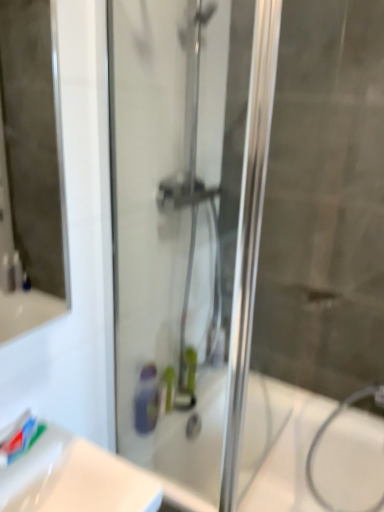
Identify the location of white matte toothpaste at lower left. (20, 437).

What do you see at coordinates (75, 479) in the screenshot?
I see `white glossy sink at lower left` at bounding box center [75, 479].

Find the location of a particular element. The image size is (384, 512). transparent glass shower door at center is located at coordinates point(183,232).

How many degrees apart are the facing directions of white glossy sink at lower left and white glossy bath at center?

89.2 degrees.

Between point (87, 462) and point (306, 451), which one is positioned in front?

Positioned in front is point (87, 462).

From the image's perspective, who appears lower, white glossy sink at lower left or white glossy bath at center?

white glossy bath at center is shown below in the image.

Does white glossy sink at lower left lie behind white glossy bath at center?

That is False.

From the image's perspective, between white glossy bath at center and white glossy sink at lower left, who is located below?

white glossy bath at center is shown below in the image.

Is white glossy bath at center situated inside white glossy sink at lower left or outside?

white glossy bath at center is spatially situated outside white glossy sink at lower left.

From a real-world perspective, which object stands above the other?

white glossy sink at lower left.

Is white glossy sink at lower left not within transparent glass shower door at center?

Yes.

Is white glossy sink at lower left shorter than transparent glass shower door at center?

Yes.

In the scene shown: Is white glossy sink at lower left smaller than transparent glass shower door at center?

Yes.

Is point (60, 495) in front of point (222, 409)?

Yes, it is in front of point (222, 409).

Based on the photo, which is less distant, (77, 509) or (17, 433)?

Clearly, point (77, 509) is closer to the camera than point (17, 433).

Considering the positions of objects white glossy sink at lower left and white matte toothpaste at lower left in the image provided, who is more to the right, white glossy sink at lower left or white matte toothpaste at lower left?

white glossy sink at lower left.

From the image's perspective, is white glossy sink at lower left on top of white matte toothpaste at lower left?

Incorrect, from the image's perspective, white glossy sink at lower left is lower than white matte toothpaste at lower left.

Considering the sizes of objects white glossy sink at lower left and white matte toothpaste at lower left in the image provided, who is shorter, white glossy sink at lower left or white matte toothpaste at lower left?

white matte toothpaste at lower left.

In terms of width, does transparent glass shower door at center look wider or thinner when compared to white matte toothpaste at lower left?

In the image, transparent glass shower door at center appears to be more narrow than white matte toothpaste at lower left.

Is transparent glass shower door at center facing towards white matte toothpaste at lower left?

Yes, transparent glass shower door at center is turned towards white matte toothpaste at lower left.

From the picture: From a real-world perspective, is transparent glass shower door at center on white matte toothpaste at lower left?

Yes.

Looking at this image, considering the sizes of transparent glass shower door at center and white matte toothpaste at lower left in the image, is transparent glass shower door at center bigger or smaller than white matte toothpaste at lower left?

transparent glass shower door at center is bigger than white matte toothpaste at lower left.

How many degrees apart are the facing directions of white matte toothpaste at lower left and white glossy bath at center?

white matte toothpaste at lower left and white glossy bath at center are facing 98 degrees away from each other.

Which is in front, point (11, 448) or point (248, 430)?

The point (11, 448) is closer to the camera.

Can you confirm if white matte toothpaste at lower left is smaller than white glossy bath at center?

Yes.

Is white matte toothpaste at lower left far away from white glossy bath at center?

Actually, white matte toothpaste at lower left and white glossy bath at center are a little close together.

Is white glossy bath at center not close to transparent glass shower door at center?

Actually, white glossy bath at center and transparent glass shower door at center are a little close together.

Is white glossy bath at center positioned in front of transparent glass shower door at center?

No, white glossy bath at center is behind transparent glass shower door at center.

From the image's perspective, does white glossy bath at center appear higher than transparent glass shower door at center?

Result: No, from the image's perspective, white glossy bath at center is not above transparent glass shower door at center.

Locate an element on the screen. bath on the right side of white glossy sink at lower left is located at coordinates (278, 445).

Find the location of a particular element. This screenshot has width=384, height=512. bath lying below the white glossy sink at lower left (from the image's perspective) is located at coordinates (278, 445).

From the image, which object appears to be nearer to white glossy sink at lower left, white glossy bath at center or white matte toothpaste at lower left?

Based on the image, white matte toothpaste at lower left appears to be nearer to white glossy sink at lower left.

From the picture: From the image, which object appears to be nearer to white glossy sink at lower left, transparent glass shower door at center or white glossy bath at center?

transparent glass shower door at center is closer to white glossy sink at lower left.

Considering their positions, is transparent glass shower door at center positioned further to white glossy sink at lower left than white matte toothpaste at lower left?

transparent glass shower door at center is positioned further to the anchor white glossy sink at lower left.

Estimate the real-world distances between objects in this image. Which object is further from transparent glass shower door at center, white glossy sink at lower left or white matte toothpaste at lower left?

Among the two, white matte toothpaste at lower left is located further to transparent glass shower door at center.

Looking at this image, when comparing their distances from transparent glass shower door at center, does white glossy bath at center or white glossy sink at lower left seem closer?

Based on the image, white glossy bath at center appears to be nearer to transparent glass shower door at center.

Estimate the real-world distances between objects in this image. Which object is further from transparent glass shower door at center, white glossy sink at lower left or white glossy bath at center?

white glossy sink at lower left is positioned further to the anchor transparent glass shower door at center.

Considering their positions, is white matte toothpaste at lower left positioned further to white glossy bath at center than transparent glass shower door at center?

white matte toothpaste at lower left is further to white glossy bath at center.

When comparing their distances from transparent glass shower door at center, does white matte toothpaste at lower left or white glossy bath at center seem closer?

white glossy bath at center.

Where is `toothpaste between transparent glass shower door at center and white glossy bath at center in the up-down direction`? toothpaste between transparent glass shower door at center and white glossy bath at center in the up-down direction is located at coordinates (20, 437).

Find the location of a particular element. The image size is (384, 512). toothpaste between transparent glass shower door at center and white glossy sink at lower left in the up-down direction is located at coordinates 20,437.

At what (x,y) coordinates should I click in order to perform the action: click on sink between white matte toothpaste at lower left and white glossy bath at center in the horizontal direction. Please return your answer as a coordinate pair (x, y). This screenshot has height=512, width=384. Looking at the image, I should click on (75, 479).

This screenshot has height=512, width=384. In order to click on sink between transparent glass shower door at center and white glossy bath at center vertically in this screenshot , I will do `click(75, 479)`.